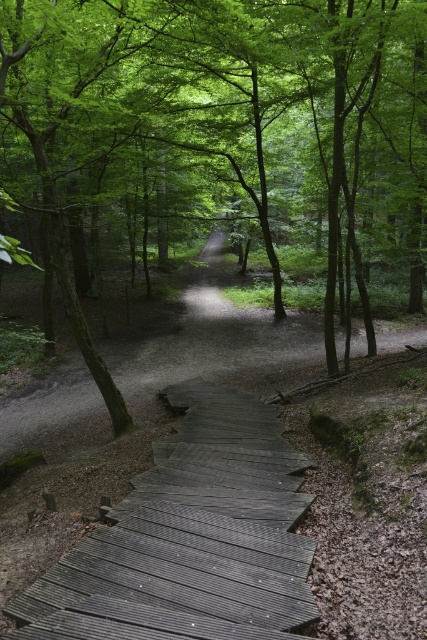
Question: Can you confirm if green leafy tree at center is smaller than dark gray wooden stairs at bottom center?

Choices:
 (A) yes
 (B) no

Answer: (B)

Question: Is green leafy tree at center closer to camera compared to dark gray wooden stairs at bottom center?

Choices:
 (A) yes
 (B) no

Answer: (B)

Question: Does green leafy tree at center lie in front of dark gray wooden stairs at bottom center?

Choices:
 (A) yes
 (B) no

Answer: (B)